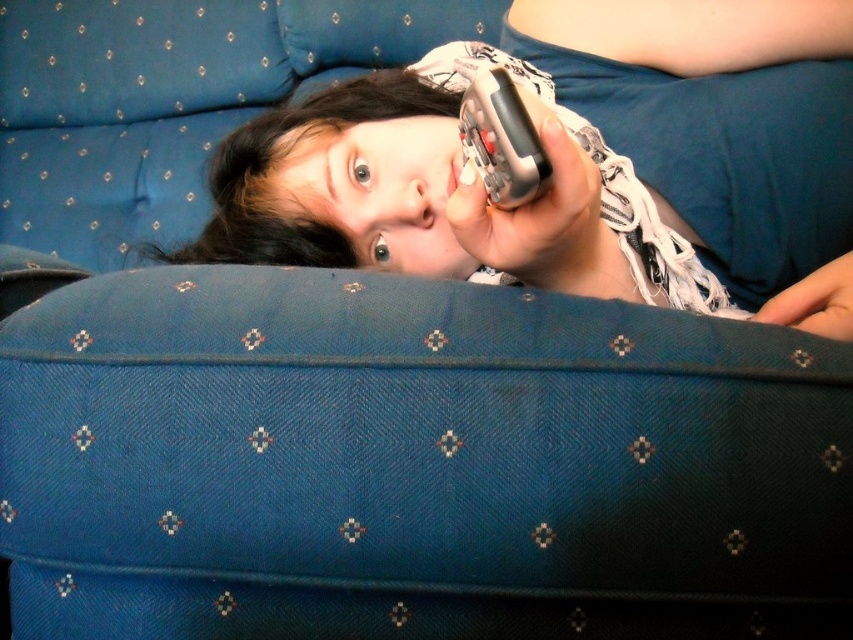
Question: Is matte plastic remote at center positioned behind metallic silver phone at upper center?

Choices:
 (A) no
 (B) yes

Answer: (B)

Question: Among these objects, which one is nearest to the camera?

Choices:
 (A) metallic silver phone at upper center
 (B) matte plastic remote at center

Answer: (A)

Question: Does matte plastic remote at center have a lesser width compared to metallic silver phone at upper center?

Choices:
 (A) yes
 (B) no

Answer: (B)

Question: From the image, what is the correct spatial relationship of matte plastic remote at center in relation to metallic silver phone at upper center?

Choices:
 (A) above
 (B) below

Answer: (A)